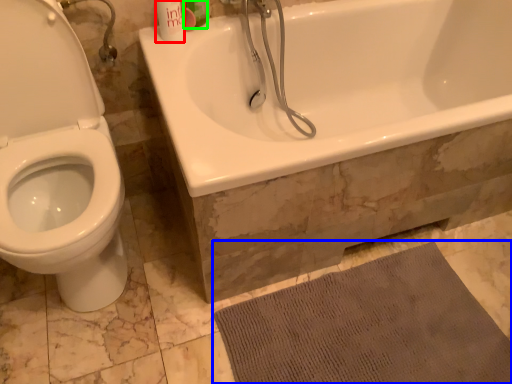
Question: Based on their relative distances, which object is nearer to mouthwash (highlighted by a red box)? Choose from bath mat (highlighted by a blue box) and mouthwash (highlighted by a green box).

Choices:
 (A) bath mat
 (B) mouthwash

Answer: (B)